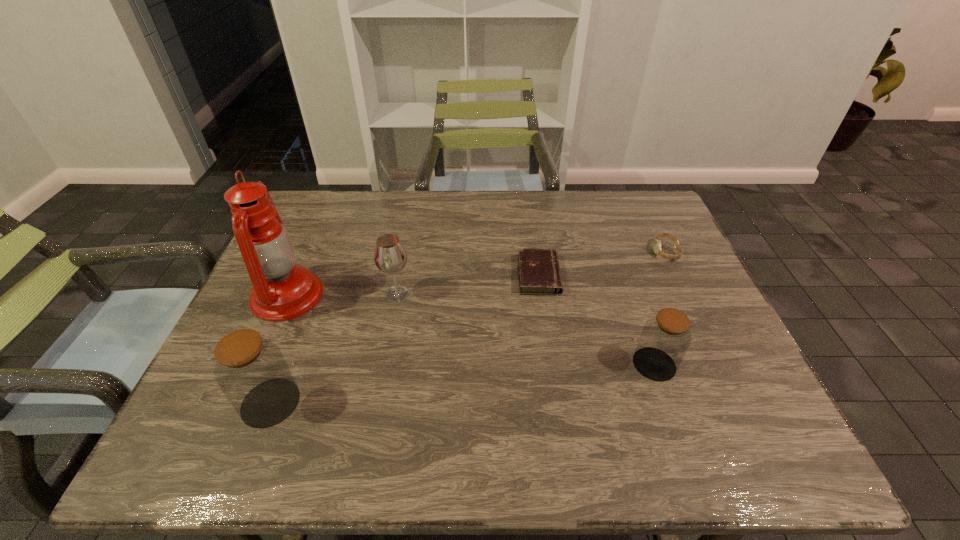
This screenshot has width=960, height=540. Find the location of `the left jar`. the left jar is located at coordinates (251, 371).

Where is `the fourth tallest object`? the fourth tallest object is located at coordinates (665, 338).

The height and width of the screenshot is (540, 960). I want to click on the right jar, so click(x=665, y=338).

Find the location of a particular element. Image resolution: width=960 pixels, height=540 pixels. the third object from left to right is located at coordinates (390, 256).

You are a GUI agent. You are given a task and a screenshot of the screen. Output one action in this format:
    pyautogui.click(x=<x>, y=<y>)
    Task: Click on the shortest object
    
    Given the screenshot: What is the action you would take?
    pyautogui.click(x=539, y=272)

I want to click on diary, so 539,272.

I want to click on oil lamp, so click(x=282, y=290).

Find the location of `the rightmost object`. the rightmost object is located at coordinates (657, 243).

You are a GUI agent. You are given a task and a screenshot of the screen. Output one action in this format:
    pyautogui.click(x=<x>, y=<y>)
    Task: Click on the watch
    This screenshot has width=960, height=540.
    Given the screenshot: What is the action you would take?
    pyautogui.click(x=657, y=243)

This screenshot has width=960, height=540. Find the location of `vacant region located 0.200m on the right of the taller jar`. vacant region located 0.200m on the right of the taller jar is located at coordinates (395, 402).